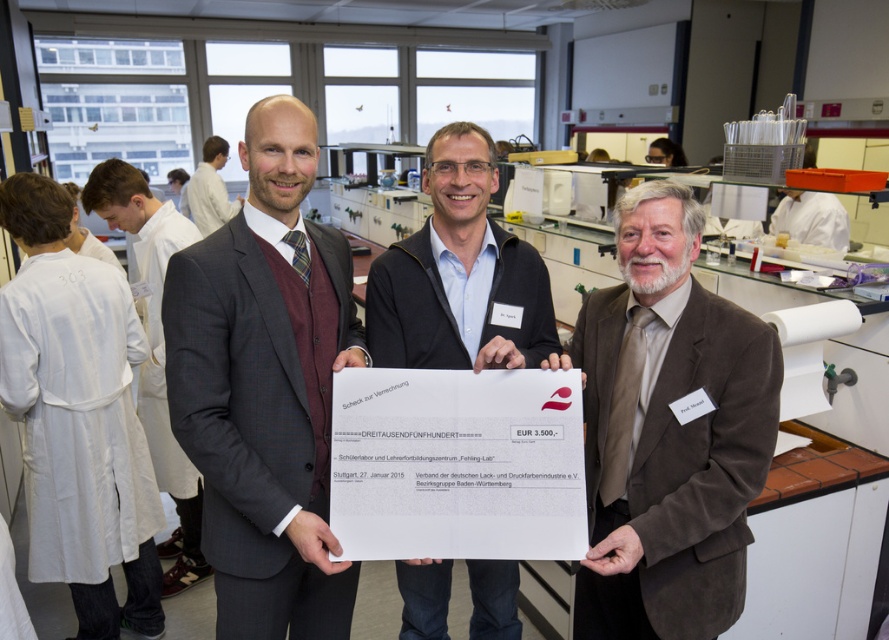
Is matte black suit at center smaller than white lab coat at left?

Yes.

Which of these two, matte black suit at center or white lab coat at left, stands taller?

white lab coat at left is taller.

Is point (254, 451) behind point (156, 304)?

No, (254, 451) is closer to viewer.

Locate an element on the screen. The width and height of the screenshot is (889, 640). matte black suit at center is located at coordinates (265, 388).

Who is lower down, matte black suit at center or brown suede suit at center?

brown suede suit at center is lower down.

Who is more forward, (x=274, y=493) or (x=669, y=547)?

Positioned in front is point (x=669, y=547).

I want to click on matte black suit at center, so click(265, 388).

Does point (226, 378) lie in front of point (450, 284)?

Yes, point (226, 378) is in front of point (450, 284).

Can you confirm if matte black suit at center is positioned to the right of matte black jacket at center?

In fact, matte black suit at center is to the left of matte black jacket at center.

Who is more forward, (239, 342) or (387, 252)?

Positioned in front is point (239, 342).

This screenshot has height=640, width=889. I want to click on matte black suit at center, so click(265, 388).